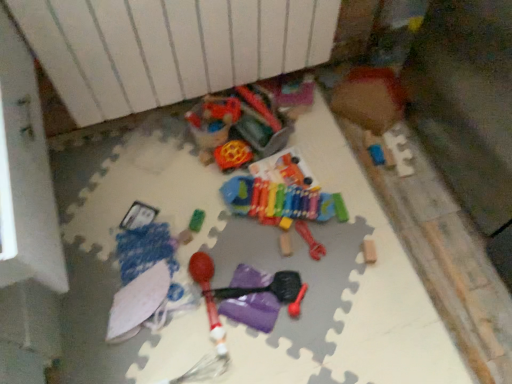
Image resolution: width=512 pixels, height=384 pixels. I want to click on free space above white matte umbrella at lower left, arranged as the second toy when ordered from the bottom (from a real-world perspective), so tap(131, 306).